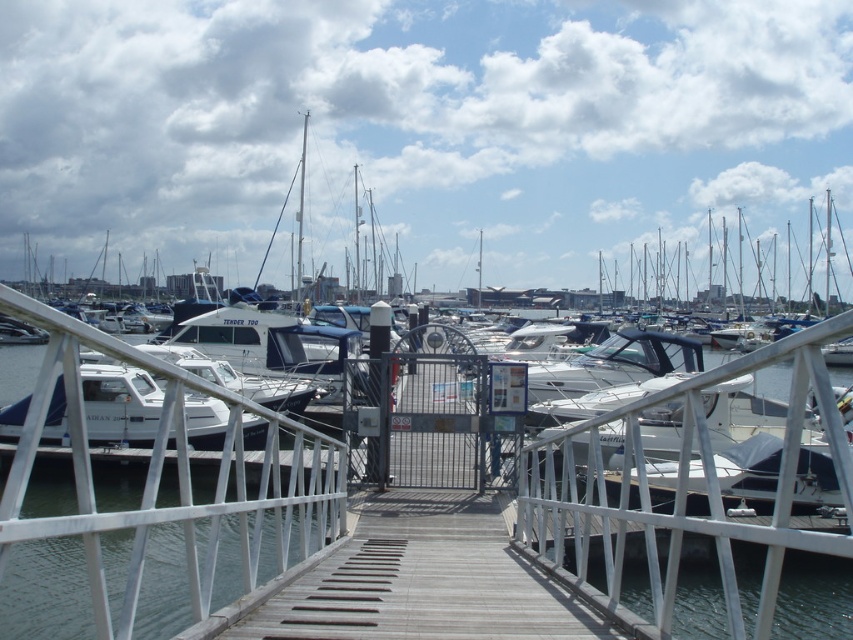
Question: Among these objects, which one is nearest to the camera?

Choices:
 (A) clear water at center
 (B) white matte boat at center

Answer: (A)

Question: Is the position of clear water at center less distant than that of white matte boat at center?

Choices:
 (A) yes
 (B) no

Answer: (A)

Question: Can you confirm if clear water at center is thinner than white matte boat at center?

Choices:
 (A) yes
 (B) no

Answer: (A)

Question: Does clear water at center have a larger size compared to white matte boat at center?

Choices:
 (A) yes
 (B) no

Answer: (B)